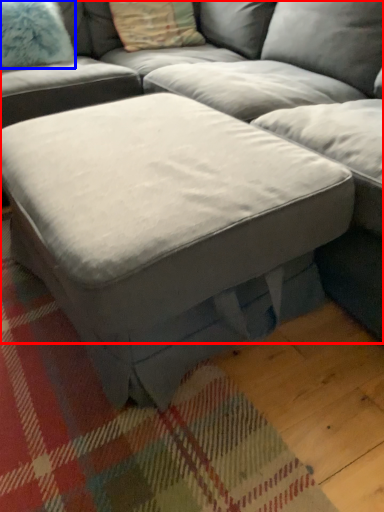
Question: Which object is closer to the camera taking this photo, studio couch (highlighted by a red box) or pillow (highlighted by a blue box)?

Choices:
 (A) studio couch
 (B) pillow

Answer: (A)